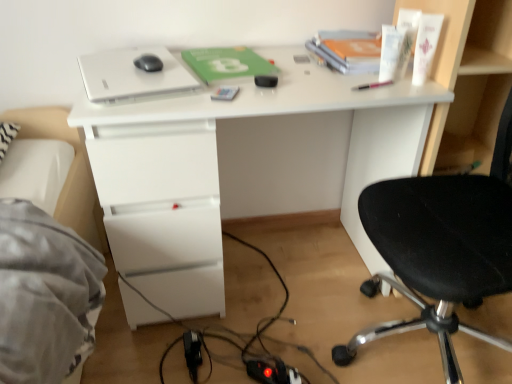
I want to click on vacant region to the left of metallic silver phone at center, positioned as the 2th stationery in right-to-left order, so click(169, 99).